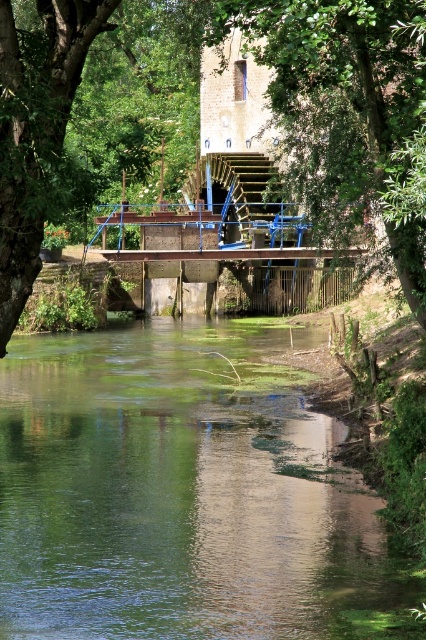
You are a bird flying over the riverside scene. You see the green reflective water at center and the green leafy tree at center. Which one do you see as closer to the ground?

The green reflective water at center is shorter than the green leafy tree at center, so the green reflective water at center is closer to the ground.

You are an environmental scientist assessing the scene. You need to determine which area has more space for sunlight penetration between the green reflective water at center and the green leafy tree at upper center. Which one allows more sunlight to pass through?

The green reflective water at center occupies less space than the green leafy tree at upper center, so it allows more sunlight to pass through.

You are an environmental scientist assessing the health of the riverside ecosystem. You observe the green reflective water at center and the green leafy tree at center. Which object covers a smaller area in the scene?

The green reflective water at center occupies less space than the green leafy tree at center, so the green reflective water at center covers a smaller area in the scene.